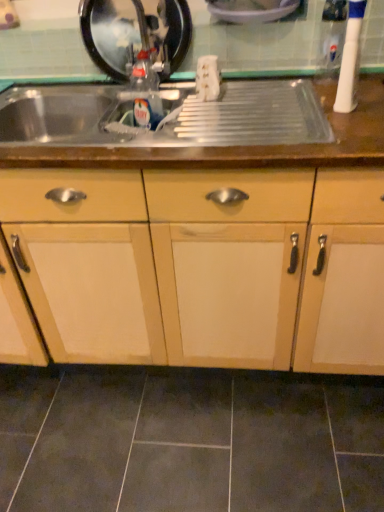
Where is `vacant area to the left of white plastic toothbrush at upper right, which is counted as the third appliance, starting from the left`? The height and width of the screenshot is (512, 384). vacant area to the left of white plastic toothbrush at upper right, which is counted as the third appliance, starting from the left is located at coordinates (281, 112).